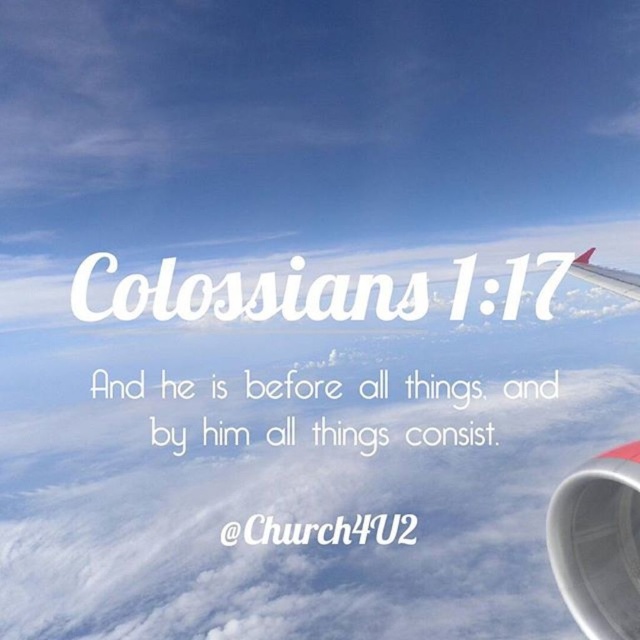
You are a pilot looking at the airplane window and see the point at coordinates (598, 544). Can you tell me what object this point is located on?

The point at coordinates (598, 544) is located on the white metallic engine at right.

You are a passenger on an airplane and notice two parts of the aircraft through the window. The white metallic engine at right and the red matte wing at upper right. Which part appears larger in size?

The red matte wing at upper right appears larger in size compared to the white metallic engine at right.